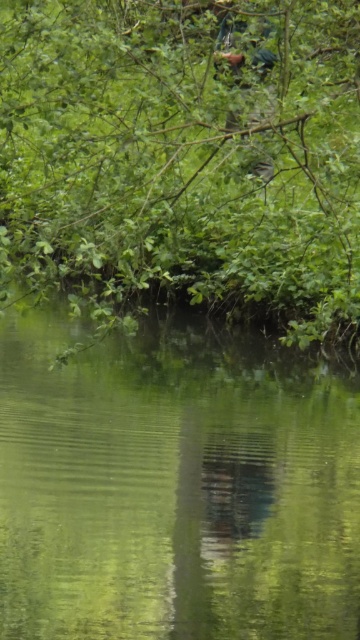
Question: From the image, what is the correct spatial relationship of green reflective water at center in relation to brown leather jacket at upper center?

Choices:
 (A) below
 (B) above

Answer: (A)

Question: Which point is farther from the camera taking this photo?

Choices:
 (A) (267, 33)
 (B) (32, 166)

Answer: (B)

Question: Which object appears farthest from the camera in this image?

Choices:
 (A) brown leather jacket at upper center
 (B) green reflective water at center

Answer: (A)

Question: From the image, what is the correct spatial relationship of green reflective water at center in relation to green leafy tree at upper center?

Choices:
 (A) above
 (B) below

Answer: (B)

Question: Does green reflective water at center have a larger size compared to green leafy tree at upper center?

Choices:
 (A) no
 (B) yes

Answer: (B)

Question: Estimate the real-world distances between objects in this image. Which object is closer to the green leafy tree at upper center?

Choices:
 (A) green reflective water at center
 (B) brown leather jacket at upper center

Answer: (B)